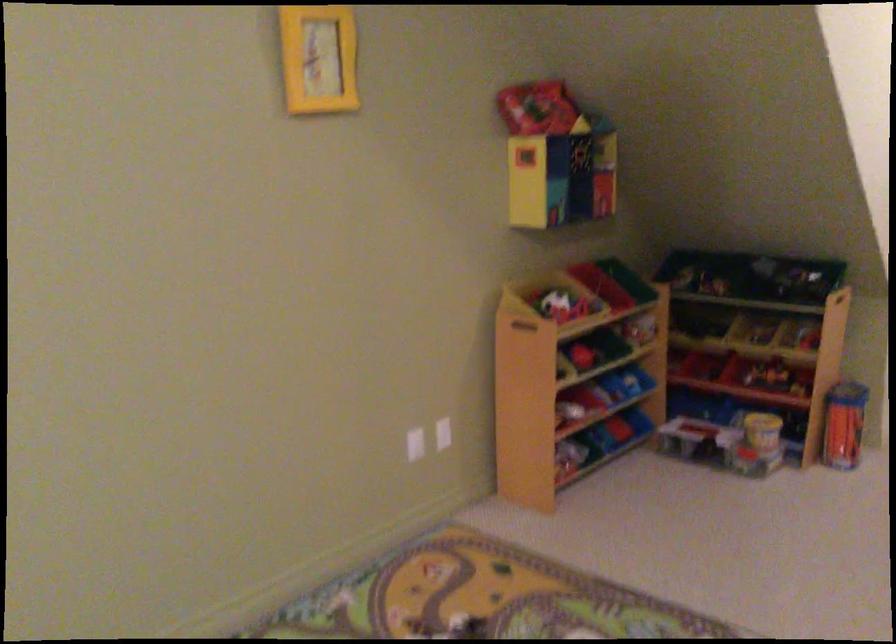
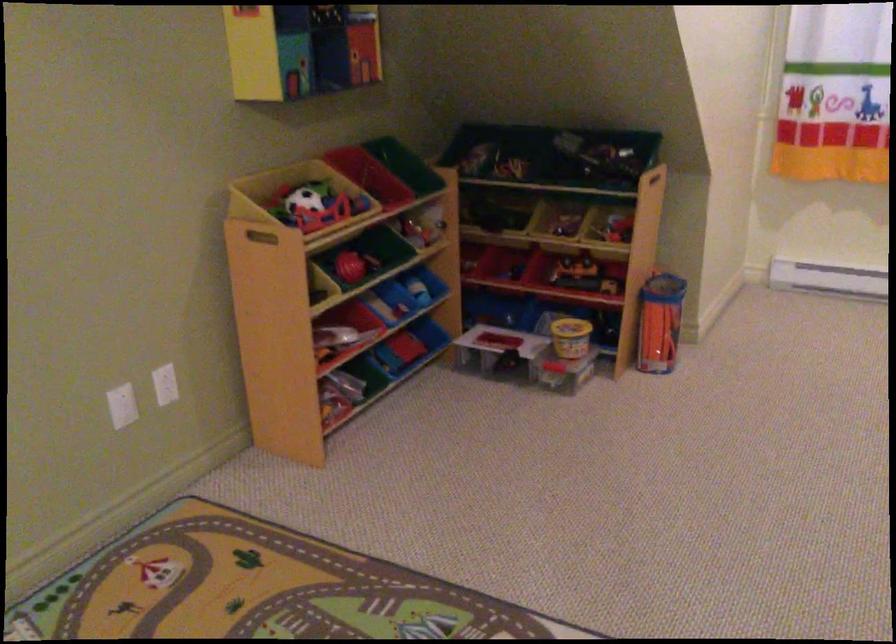
Question: Based on the continuous images, in which direction is the camera rotating? Reply with the corresponding letter.

Choices:
 (A) Left
 (B) Right
 (C) Up
 (D) Down

Answer: (B)